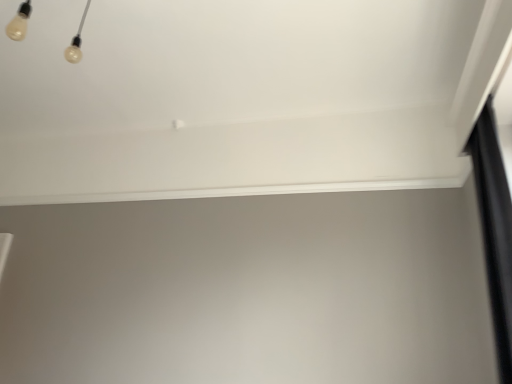
Describe the element at coordinates (233, 191) in the screenshot. This screenshot has width=512, height=384. I see `white smooth window sill at upper center` at that location.

The height and width of the screenshot is (384, 512). Identify the location of white smooth window sill at upper center. (233, 191).

Describe the element at coordinates (495, 230) in the screenshot. I see `black matte curtain at right` at that location.

Image resolution: width=512 pixels, height=384 pixels. Identify the location of black matte curtain at right. (495, 230).

Where is `white smooth window sill at upper center`? white smooth window sill at upper center is located at coordinates (233, 191).

Which object is positioned more to the left, white smooth window sill at upper center or black matte curtain at right?

white smooth window sill at upper center.

Is white smooth window sill at upper center closer to the viewer compared to black matte curtain at right?

No, white smooth window sill at upper center is further to the viewer.

Is point (258, 195) in front of point (507, 342)?

No, it is behind (507, 342).

From the image's perspective, is white smooth window sill at upper center positioned above or below black matte curtain at right?

Clearly, from the image's perspective, white smooth window sill at upper center is above black matte curtain at right.

From a real-world perspective, is white smooth window sill at upper center physically below black matte curtain at right?

No, from a real-world perspective, white smooth window sill at upper center is not beneath black matte curtain at right.

In terms of width, does white smooth window sill at upper center look wider or thinner when compared to black matte curtain at right?

Considering their sizes, white smooth window sill at upper center looks slimmer than black matte curtain at right.

Considering the relative sizes of white smooth window sill at upper center and black matte curtain at right in the image provided, is white smooth window sill at upper center taller than black matte curtain at right?

No.

Is white smooth window sill at upper center bigger or smaller than black matte curtain at right?

In the image, white smooth window sill at upper center appears to be smaller than black matte curtain at right.

Choose the correct answer: Is white smooth window sill at upper center inside black matte curtain at right or outside it?

white smooth window sill at upper center exists outside the volume of black matte curtain at right.

Are white smooth window sill at upper center and black matte curtain at right making contact?

No, white smooth window sill at upper center is not beside black matte curtain at right.

Does white smooth window sill at upper center turn towards black matte curtain at right?

No, white smooth window sill at upper center is not aimed at black matte curtain at right.

Where is `curtain located below the white smooth window sill at upper center (from the image's perspective)`? Image resolution: width=512 pixels, height=384 pixels. curtain located below the white smooth window sill at upper center (from the image's perspective) is located at coordinates (495, 230).

Would you say black matte curtain at right is to the left or to the right of white smooth window sill at upper center in the picture?

black matte curtain at right is to the right of white smooth window sill at upper center.

In the image, is black matte curtain at right positioned in front of or behind white smooth window sill at upper center?

Clearly, black matte curtain at right is in front of white smooth window sill at upper center.

Considering the points (498, 356) and (271, 192), which point is in front, point (498, 356) or point (271, 192)?

Point (498, 356)

From the image's perspective, between black matte curtain at right and white smooth window sill at upper center, who is located below?

black matte curtain at right.

From a real-world perspective, which object rests below the other?

From a 3D spatial view, black matte curtain at right is below.

Which of these two, black matte curtain at right or white smooth window sill at upper center, is thinner?

white smooth window sill at upper center is thinner.

Considering the relative sizes of black matte curtain at right and white smooth window sill at upper center in the image provided, is black matte curtain at right taller than white smooth window sill at upper center?

Yes, black matte curtain at right is taller than white smooth window sill at upper center.

Considering the sizes of objects black matte curtain at right and white smooth window sill at upper center in the image provided, who is smaller, black matte curtain at right or white smooth window sill at upper center?

Smaller between the two is white smooth window sill at upper center.

Is black matte curtain at right surrounding white smooth window sill at upper center?

No, white smooth window sill at upper center is not inside black matte curtain at right.

Are black matte curtain at right and white smooth window sill at upper center far apart?

black matte curtain at right is far away from white smooth window sill at upper center.

Could you tell me if black matte curtain at right is turned towards white smooth window sill at upper center?

No, black matte curtain at right is not turned towards white smooth window sill at upper center.

Locate an element on the screen. This screenshot has height=384, width=512. curtain below the white smooth window sill at upper center (from a real-world perspective) is located at coordinates (495, 230).

This screenshot has width=512, height=384. There is a black matte curtain at right. What are the coordinates of `window sill above it (from a real-world perspective)` in the screenshot? It's located at (233, 191).

In order to click on curtain below the white smooth window sill at upper center (from the image's perspective) in this screenshot , I will do `click(495, 230)`.